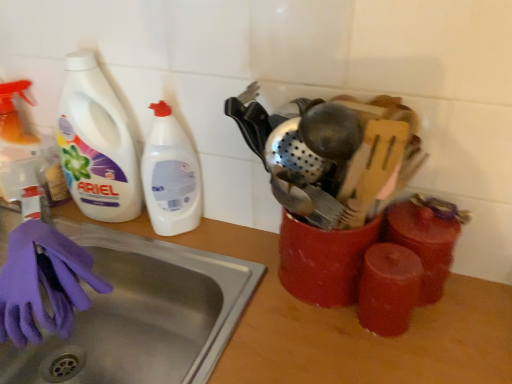
Question: From the image's perspective, is purple rubber glove at lower left located above or below white plastic bottle at left?

Choices:
 (A) below
 (B) above

Answer: (A)

Question: Considering the relative positions of purple rubber glove at lower left and white plastic bottle at left in the image provided, is purple rubber glove at lower left to the left or to the right of white plastic bottle at left?

Choices:
 (A) left
 (B) right

Answer: (A)

Question: Based on their relative distances, which object is nearer to the white plastic bottle at left?

Choices:
 (A) white plastic bottle at left
 (B) wooden counter top at center
 (C) purple rubber glove at lower left
 (D) stainless steel sink at lower left

Answer: (A)

Question: Which object is the farthest from the white plastic bottle at left?

Choices:
 (A) wooden counter top at center
 (B) white plastic bottle at left
 (C) stainless steel sink at lower left
 (D) purple rubber glove at lower left

Answer: (A)